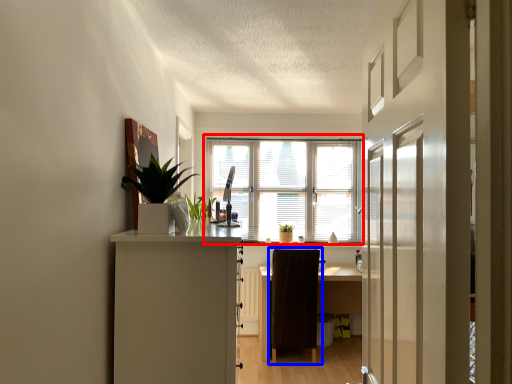
Question: Which object is closer to the camera taking this photo, window (highlighted by a red box) or chair (highlighted by a blue box)?

Choices:
 (A) window
 (B) chair

Answer: (B)